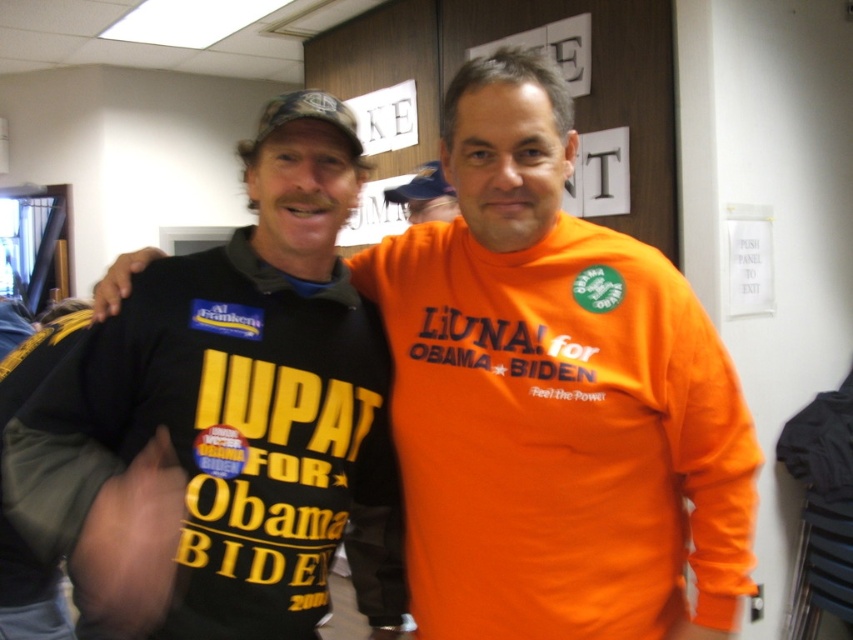
Question: Which point is farther to the camera?

Choices:
 (A) matte black t-shirt at center
 (B) matte black t-shirt at left

Answer: (A)

Question: Which of these objects is positioned farthest from the matte black t-shirt at left?

Choices:
 (A) matte black t-shirt at center
 (B) orange t-shirt at center

Answer: (B)

Question: Estimate the real-world distances between objects in this image. Which object is closer to the orange t-shirt at center?

Choices:
 (A) matte black t-shirt at left
 (B) matte black t-shirt at center

Answer: (B)

Question: Can you confirm if matte black t-shirt at center is positioned to the left of orange t-shirt at center?

Choices:
 (A) no
 (B) yes

Answer: (A)

Question: Is the position of matte black t-shirt at center less distant than that of orange t-shirt at center?

Choices:
 (A) no
 (B) yes

Answer: (B)

Question: Considering the relative positions of matte black t-shirt at center and matte black t-shirt at left in the image provided, where is matte black t-shirt at center located with respect to matte black t-shirt at left?

Choices:
 (A) right
 (B) left

Answer: (A)